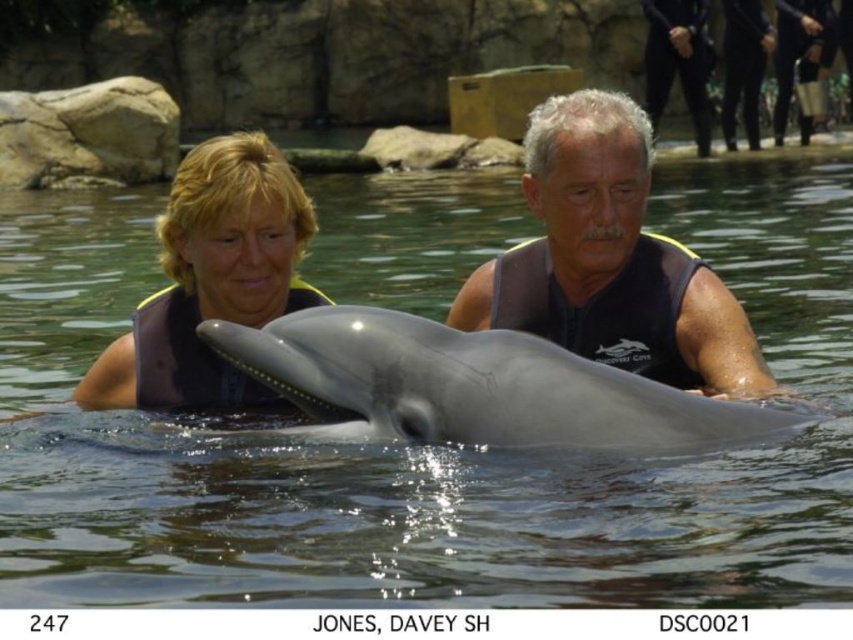
Question: Does matte black wetsuit at upper center appear over black neoprene wetsuit at upper right?

Choices:
 (A) no
 (B) yes

Answer: (B)

Question: Does matte black wetsuit at upper center have a greater width compared to black neoprene wetsuit at upper right?

Choices:
 (A) no
 (B) yes

Answer: (B)

Question: Does matte black wetsuit at center have a lesser width compared to black neoprene wetsuit at upper right?

Choices:
 (A) no
 (B) yes

Answer: (A)

Question: Among these points, which one is nearest to the camera?

Choices:
 (A) (653, 19)
 (B) (340, 349)
 (C) (271, 224)
 (D) (531, 116)

Answer: (B)

Question: Which point appears farthest from the camera in this image?

Choices:
 (A) (708, 124)
 (B) (635, 202)
 (C) (778, 118)

Answer: (C)

Question: Which of the following is the farthest from the observer?

Choices:
 (A) (654, 90)
 (B) (431, 408)
 (C) (196, 358)
 (D) (581, 161)

Answer: (A)